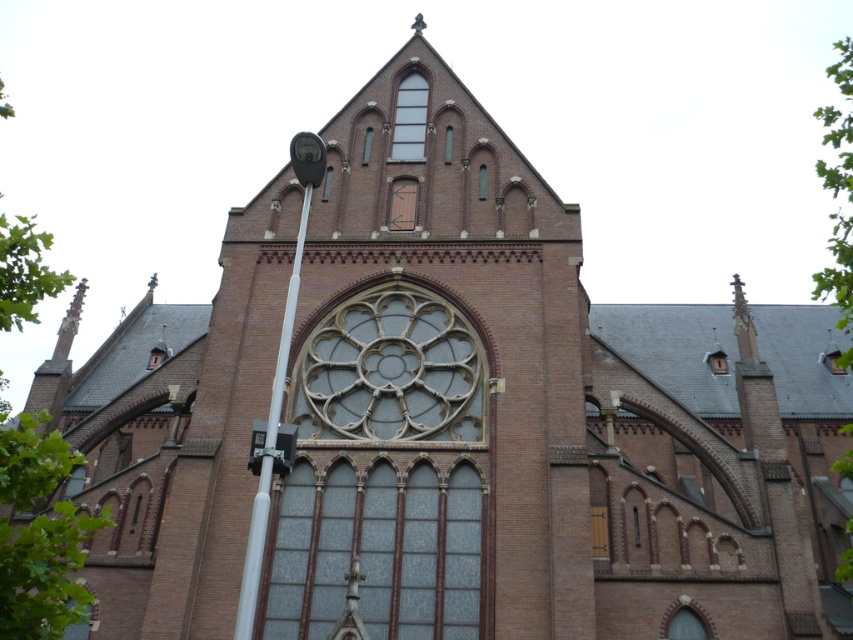
Which is more to the left, green leafy tree at left or clear glass window at upper center?

green leafy tree at left

Does green leafy tree at left appear on the left side of clear glass window at upper center?

Correct, you'll find green leafy tree at left to the left of clear glass window at upper center.

Is point (55, 467) closer to camera compared to point (412, 100)?

Yes, it is.

The image size is (853, 640). In order to click on green leafy tree at left in this screenshot , I will do `click(42, 572)`.

In the scene shown: Does stained glass window at center have a larger size compared to white metallic pole at left?

No, stained glass window at center is not bigger than white metallic pole at left.

Consider the image. Is stained glass window at center taller than white metallic pole at left?

In fact, stained glass window at center may be shorter than white metallic pole at left.

This screenshot has height=640, width=853. I want to click on stained glass window at center, so click(x=376, y=552).

Is green leafy tree at upper right wider than white metallic pole at left?

Yes.

Can you confirm if green leafy tree at upper right is bigger than white metallic pole at left?

Yes.

Measure the distance between point (x=850, y=52) and camera.

The distance of point (x=850, y=52) from camera is 169.14 meters.

The height and width of the screenshot is (640, 853). Identify the location of green leafy tree at upper right. 838,195.